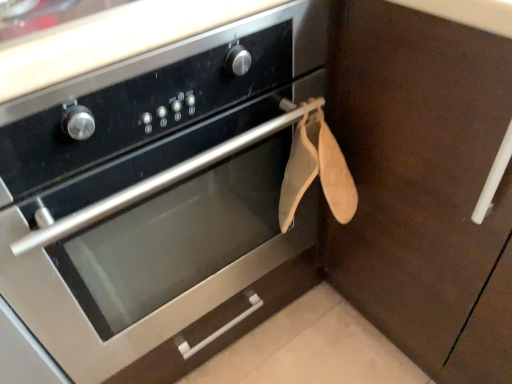
Question: Considering the positions of point (x=414, y=119) and point (x=212, y=319), is point (x=414, y=119) closer or farther from the camera than point (x=212, y=319)?

Choices:
 (A) closer
 (B) farther

Answer: (A)

Question: Is brown matte cabinet at upper right taller or shorter than satin black oven at center?

Choices:
 (A) short
 (B) tall

Answer: (A)

Question: Considering the relative positions of brown matte cabinet at upper right and satin black oven at center in the image provided, is brown matte cabinet at upper right to the left or to the right of satin black oven at center?

Choices:
 (A) right
 (B) left

Answer: (A)

Question: In the image, is satin black oven at center on the left side or the right side of brown matte cabinet at upper right?

Choices:
 (A) left
 (B) right

Answer: (A)

Question: Considering the positions of satin black oven at center and brown matte cabinet at upper right in the image, is satin black oven at center wider or thinner than brown matte cabinet at upper right?

Choices:
 (A) wide
 (B) thin

Answer: (B)

Question: From the image's perspective, is satin black oven at center positioned above or below brown matte cabinet at upper right?

Choices:
 (A) below
 (B) above

Answer: (A)

Question: Is satin black oven at center situated inside brown matte cabinet at upper right or outside?

Choices:
 (A) inside
 (B) outside

Answer: (B)